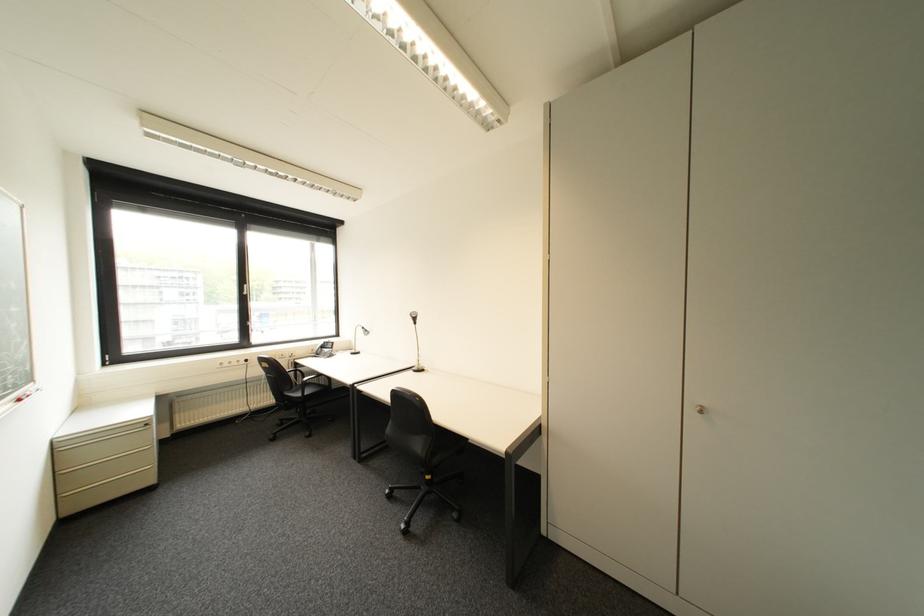
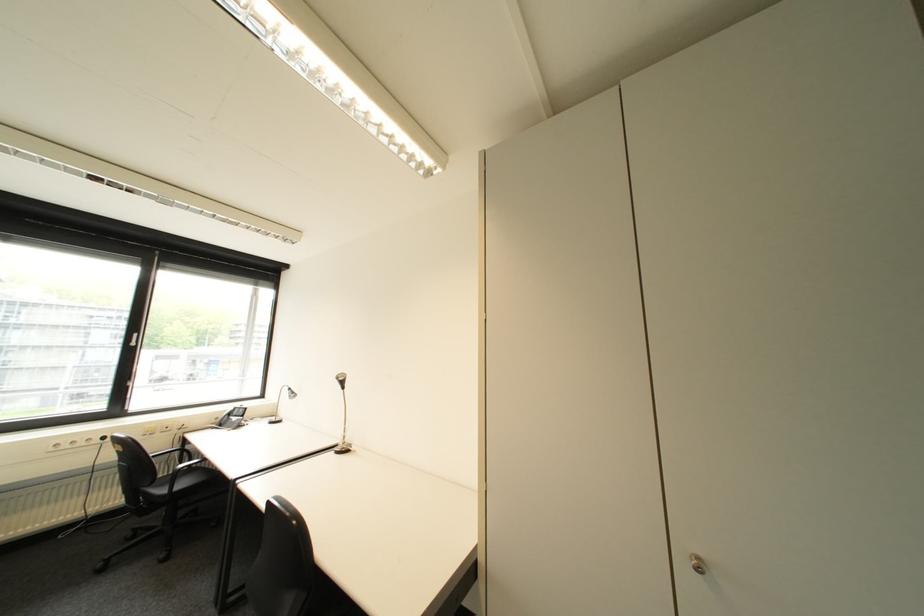
Which direction would the cameraman need to move to produce the second image?

The movement direction of the cameraman is right, forward.